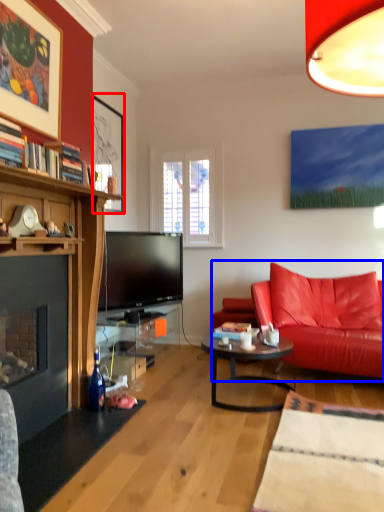
Question: Which of the following is the closest to the observer, picture frame (highlighted by a red box) or studio couch (highlighted by a blue box)?

Choices:
 (A) picture frame
 (B) studio couch

Answer: (B)